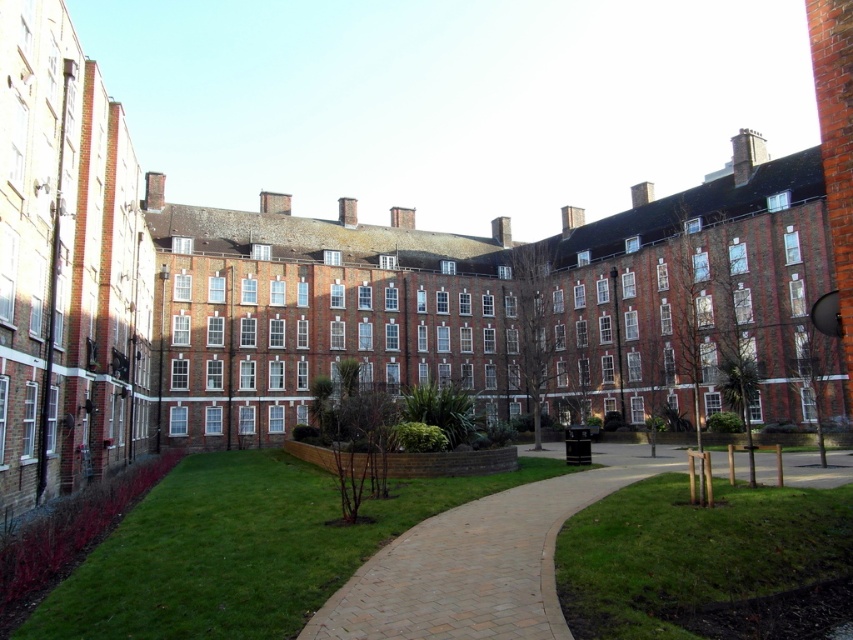
Can you confirm if green grass at lower left is shorter than green grass at lower right?

Correct, green grass at lower left is not as tall as green grass at lower right.

Does point (262, 586) come farther from viewer compared to point (833, 492)?

No.

Locate an element on the screen. The height and width of the screenshot is (640, 853). green grass at lower left is located at coordinates (241, 548).